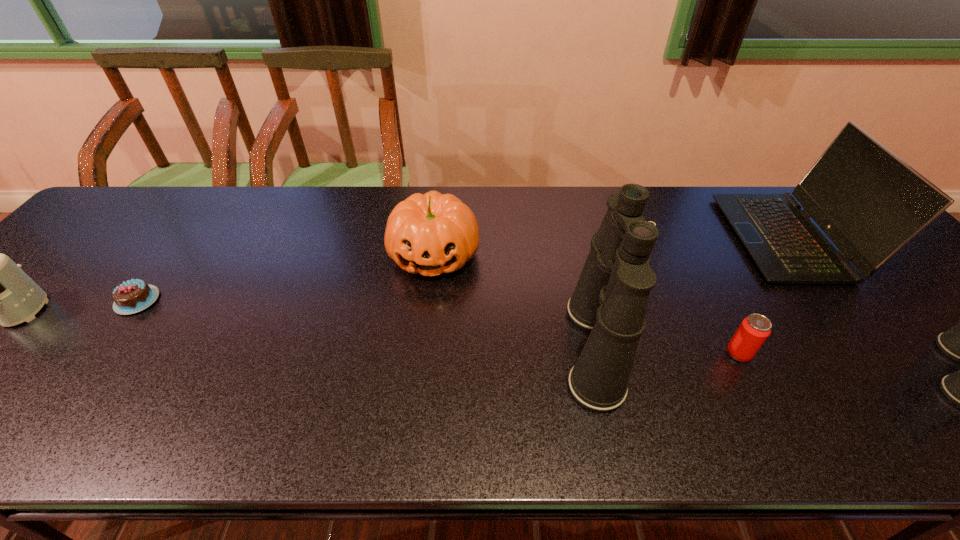
The image size is (960, 540). I want to click on object that is at the right edge, so click(870, 203).

Where is `object located at the far right corner`? The image size is (960, 540). object located at the far right corner is located at coordinates (870, 203).

The height and width of the screenshot is (540, 960). I want to click on vacant space at the far edge of the desktop, so click(x=572, y=206).

Identify the location of free spot at the near edge of the desktop. The height and width of the screenshot is (540, 960). (351, 389).

Where is `blank space at the right edge of the desktop`? The height and width of the screenshot is (540, 960). blank space at the right edge of the desktop is located at coordinates (938, 361).

In the image, there is a desktop. What are the coordinates of `vacant space at the far left corner` in the screenshot? It's located at (136, 225).

Where is `blank region between the shortest object and the tallest object`? The image size is (960, 540). blank region between the shortest object and the tallest object is located at coordinates (366, 325).

The width and height of the screenshot is (960, 540). Find the location of `empty space between the tallest object and the pumpkin`. empty space between the tallest object and the pumpkin is located at coordinates (514, 301).

Where is `unoccupied position between the laptop computer and the shortest object`? The height and width of the screenshot is (540, 960). unoccupied position between the laptop computer and the shortest object is located at coordinates (462, 269).

The width and height of the screenshot is (960, 540). I want to click on free space between the tallest object and the laptop computer, so click(x=690, y=293).